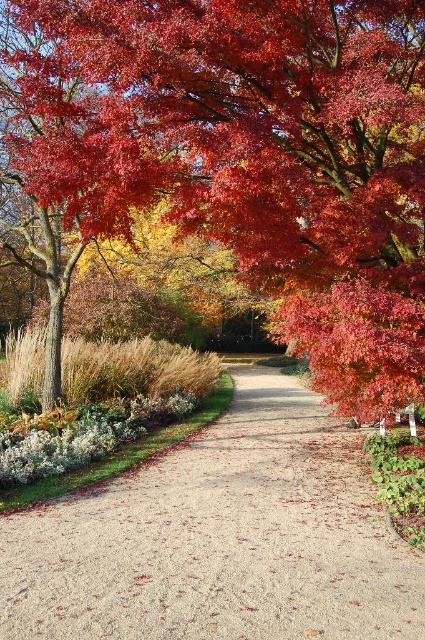
You are a gardener planning to plant a new shrub along the gravel path at center. Considering the position of the shiny red maple tree at center, where should you place the shrub to ensure it gets enough sunlight?

Since the gravel path at center is behind the shiny red maple tree at center, the shrub should be placed on the side of the path opposite the tree to ensure it receives adequate sunlight.

You are a gardener standing on the gravel pathway in the autumn garden. You want to place a decorative stone between the shiny red maple tree at center and the glossy red maple leaf at upper right. Based on their positions, where should you place the stone to ensure it is closer to the tree than the leaf?

The shiny red maple tree at center is in front of the glossy red maple leaf at upper right, so placing the stone near the base of the shiny red maple tree at center will ensure it is closer to the tree than the leaf.

You are a gardener planning to plant a new tree in the garden. You want to ensure that the shiny red maple tree at center does not overshadow the glossy red maple leaf at upper right. Based on their current positions, is this possible?

The shiny red maple tree at center is positioned over the glossy red maple leaf at upper right. Since the tree is above the leaf, planting the new tree in a way that avoids overshadowing the leaf may be possible by placing it in a different area not directly above.